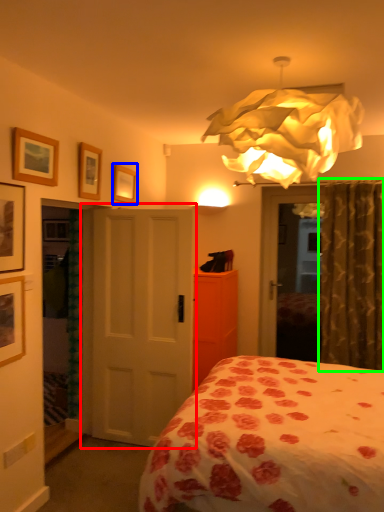
Question: Which object is positioned closest to door (highlighted by a red box)? Select from picture frame (highlighted by a blue box) and curtain (highlighted by a green box).

Choices:
 (A) picture frame
 (B) curtain

Answer: (A)